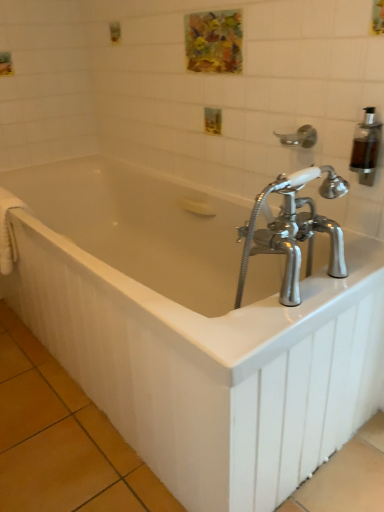
Measure the distance between silver metallic shower head at upper right and camera.

silver metallic shower head at upper right and camera are 1.25 meters apart from each other.

Image resolution: width=384 pixels, height=512 pixels. Describe the element at coordinates (8, 231) in the screenshot. I see `white fabric towel bar at left` at that location.

Locate an element on the screen. The width and height of the screenshot is (384, 512). white fabric towel bar at left is located at coordinates (8, 231).

In order to click on silver metallic shower head at upper right in this screenshot , I will do `click(299, 137)`.

Does silver metallic shower head at upper right turn towards watercolor painting at upper center?

No, silver metallic shower head at upper right is not turned towards watercolor painting at upper center.

Is silver metallic shower head at upper right to the left of watercolor painting at upper center from the viewer's perspective?

No.

From the image's perspective, which is above, silver metallic shower head at upper right or watercolor painting at upper center?

watercolor painting at upper center is shown above in the image.

From a real-world perspective, does transparent plastic soap dispenser at upper right stand above white fabric towel bar at left?

Indeed, from a real-world perspective, transparent plastic soap dispenser at upper right stands above white fabric towel bar at left.

From the image's perspective, relative to white fabric towel bar at left, is transparent plastic soap dispenser at upper right above or below?

transparent plastic soap dispenser at upper right is above white fabric towel bar at left.

Based on the photo, considering the sizes of objects transparent plastic soap dispenser at upper right and white fabric towel bar at left in the image provided, who is shorter, transparent plastic soap dispenser at upper right or white fabric towel bar at left?

With less height is transparent plastic soap dispenser at upper right.

Is watercolor painting at upper center further to camera compared to silver metallic shower head at upper right?

Yes.

Can you confirm if watercolor painting at upper center is positioned to the right of silver metallic shower head at upper right?

No, watercolor painting at upper center is not to the right of silver metallic shower head at upper right.

From the image's perspective, would you say watercolor painting at upper center is positioned over silver metallic shower head at upper right?

Yes, from the image's perspective, watercolor painting at upper center is over silver metallic shower head at upper right.

Is watercolor painting at upper center facing away from silver metallic shower head at upper right?

No.

Considering the relative sizes of silver metallic shower head at upper right and transparent plastic soap dispenser at upper right in the image provided, is silver metallic shower head at upper right bigger than transparent plastic soap dispenser at upper right?

Yes, silver metallic shower head at upper right is bigger than transparent plastic soap dispenser at upper right.

From a real-world perspective, is silver metallic shower head at upper right located higher than transparent plastic soap dispenser at upper right?

Actually, silver metallic shower head at upper right is physically below transparent plastic soap dispenser at upper right in the real world.

Is there a large distance between silver metallic shower head at upper right and transparent plastic soap dispenser at upper right?

They are positioned close to each other.

Measure the distance from silver metallic shower head at upper right to transparent plastic soap dispenser at upper right.

silver metallic shower head at upper right is 6.83 inches from transparent plastic soap dispenser at upper right.

Visually, is watercolor painting at upper center positioned to the left or to the right of white fabric towel bar at left?

watercolor painting at upper center is to the right of white fabric towel bar at left.

Can you see watercolor painting at upper center touching white fabric towel bar at left?

They are not placed beside each other.

Considering the sizes of objects watercolor painting at upper center and white fabric towel bar at left in the image provided, who is wider, watercolor painting at upper center or white fabric towel bar at left?

A: white fabric towel bar at left.

From a real-world perspective, which object stands above the other?

In real-world perspective, watercolor painting at upper center is above.

You are a GUI agent. You are given a task and a screenshot of the screen. Output one action in this format:
    pyautogui.click(x=<x>, y=<y>)
    Task: Click on the shower that is in front of the white fabric towel bar at left
    
    Given the screenshot: What is the action you would take?
    pyautogui.click(x=299, y=137)

Can we say white fabric towel bar at left lies outside silver metallic shower head at upper right?

white fabric towel bar at left is positioned outside silver metallic shower head at upper right.

From the image's perspective, which object appears higher, white fabric towel bar at left or silver metallic shower head at upper right?

silver metallic shower head at upper right appears higher in the image.

Is the position of white fabric towel bar at left less distant than that of silver metallic shower head at upper right?

No.

Does point (363, 182) come behind point (303, 128)?

No, it is not.

From the picture: Is transparent plastic soap dispenser at upper right surrounding silver metallic shower head at upper right?

That's incorrect, silver metallic shower head at upper right is not inside transparent plastic soap dispenser at upper right.

Is transparent plastic soap dispenser at upper right facing towards silver metallic shower head at upper right?

No, transparent plastic soap dispenser at upper right is not oriented towards silver metallic shower head at upper right.

Would you consider transparent plastic soap dispenser at upper right to be distant from silver metallic shower head at upper right?

transparent plastic soap dispenser at upper right is actually quite close to silver metallic shower head at upper right.

Locate an element on the screen. The height and width of the screenshot is (512, 384). art behind the silver metallic shower head at upper right is located at coordinates (214, 41).

Image resolution: width=384 pixels, height=512 pixels. Identify the location of soap dispenser above the white fabric towel bar at left (from a real-world perspective). (366, 147).

Looking at the image, which one is located closer to watercolor painting at upper center, white fabric towel bar at left or white glossy bathtub at center?

A: Based on the image, white glossy bathtub at center appears to be nearer to watercolor painting at upper center.

Which object lies nearer to the anchor point silver metallic shower head at upper right, white glossy bathtub at center or transparent plastic soap dispenser at upper right?

Based on the image, transparent plastic soap dispenser at upper right appears to be nearer to silver metallic shower head at upper right.

Consider the image. When comparing their distances from transparent plastic soap dispenser at upper right, does white fabric towel bar at left or watercolor painting at upper center seem further?

white fabric towel bar at left is further to transparent plastic soap dispenser at upper right.

Estimate the real-world distances between objects in this image. Which object is further from transparent plastic soap dispenser at upper right, white fabric towel bar at left or white glossy bathtub at center?

white fabric towel bar at left.

From the image, which object appears to be farther from transparent plastic soap dispenser at upper right, silver metallic shower head at upper right or watercolor painting at upper center?

Based on the image, watercolor painting at upper center appears to be further to transparent plastic soap dispenser at upper right.

Which object lies further to the anchor point white fabric towel bar at left, watercolor painting at upper center or silver metallic shower head at upper right?

silver metallic shower head at upper right.

Based on the photo, considering their positions, is white glossy bathtub at center positioned further to white fabric towel bar at left than silver metallic shower head at upper right?

Based on the image, silver metallic shower head at upper right appears to be further to white fabric towel bar at left.

From the image, which object appears to be nearer to white fabric towel bar at left, white glossy bathtub at center or transparent plastic soap dispenser at upper right?

white glossy bathtub at center is positioned closer to the anchor white fabric towel bar at left.

Locate an element on the screen. The height and width of the screenshot is (512, 384). bathtub situated between white fabric towel bar at left and silver metallic shower head at upper right from left to right is located at coordinates (195, 330).

Identify the location of towel bar between watercolor painting at upper center and white glossy bathtub at center in the vertical direction. The image size is (384, 512). (8, 231).

Locate an element on the screen. This screenshot has height=512, width=384. shower located between white glossy bathtub at center and transparent plastic soap dispenser at upper right in the left-right direction is located at coordinates coord(299,137).

The height and width of the screenshot is (512, 384). What are the coordinates of `shower between white fabric towel bar at left and transparent plastic soap dispenser at upper right` in the screenshot? It's located at (299, 137).